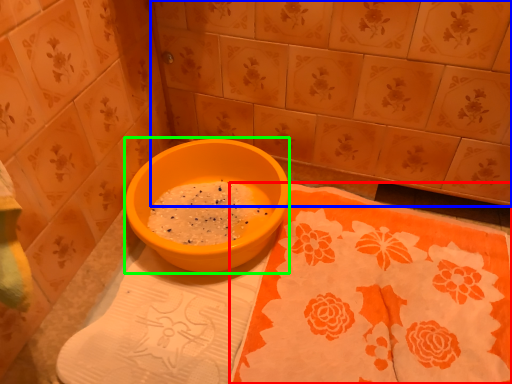
Question: Considering the real-world distances, which object is closest to tablecloth (highlighted by a red box)? ceramic tile (highlighted by a blue box) or basin (highlighted by a green box).

Choices:
 (A) ceramic tile
 (B) basin

Answer: (B)